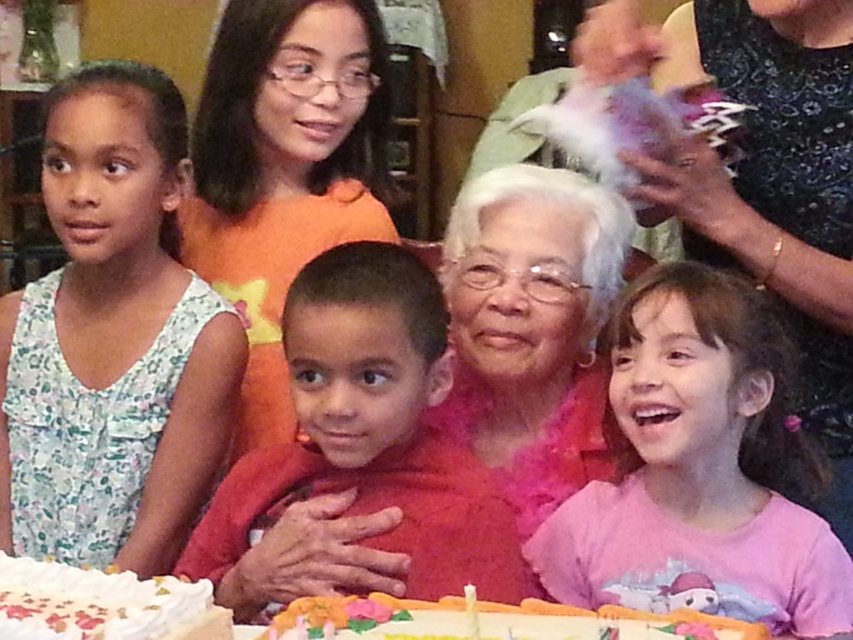
Question: Does pink cotton shirt at lower right appear on the left side of white frosted cake with colorful decorations at lower center?

Choices:
 (A) no
 (B) yes

Answer: (A)

Question: Is the position of pink cotton shirt at lower right less distant than that of matte orange blouse at center?

Choices:
 (A) yes
 (B) no

Answer: (A)

Question: Can you confirm if floral fabric dress at left is smaller than white frosted cake at lower left?

Choices:
 (A) no
 (B) yes

Answer: (A)

Question: Estimate the real-world distances between objects in this image. Which object is closer to the smooth red shirt at center?

Choices:
 (A) white frosted cake with colorful decorations at lower center
 (B) matte orange blouse at center
 (C) floral fabric dress at left
 (D) pink cotton shirt at lower right

Answer: (A)

Question: Which object is farther from the camera taking this photo?

Choices:
 (A) floral fabric dress at left
 (B) pink cotton shirt at lower right
 (C) matte orange blouse at center

Answer: (C)

Question: Which object appears closest to the camera in this image?

Choices:
 (A) pink cotton shirt at lower right
 (B) matte orange blouse at center

Answer: (A)